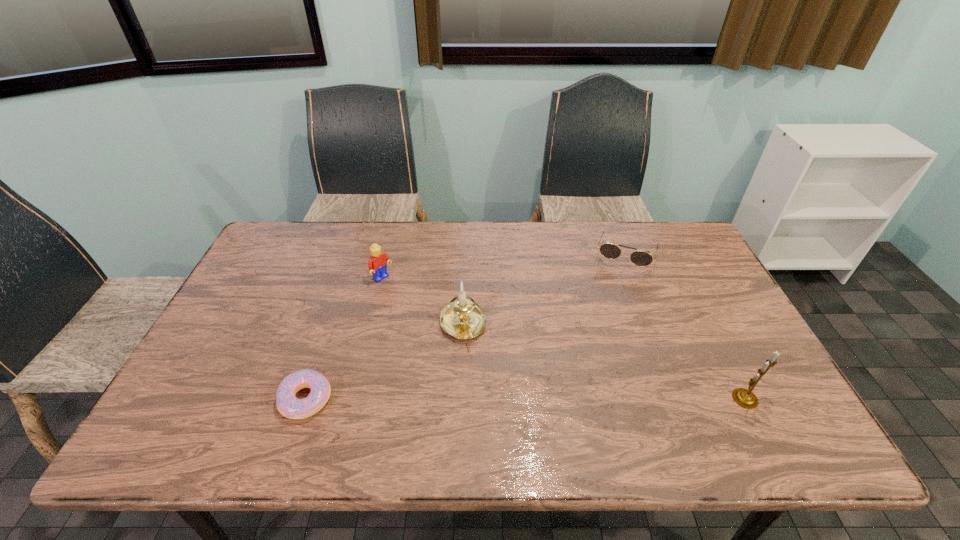
You are a GUI agent. You are given a task and a screenshot of the screen. Output one action in this format:
    pyautogui.click(x=<x>, y=<y>)
    Task: Click on the free region located 0.330m on the front lenses of the fourth tallest object
    The height and width of the screenshot is (540, 960).
    Given the screenshot: What is the action you would take?
    pyautogui.click(x=597, y=351)

The width and height of the screenshot is (960, 540). Find the location of `blank area located on the front lenses of the fourth tallest object`. blank area located on the front lenses of the fourth tallest object is located at coordinates (607, 317).

Where is `vacant space located on the front lenses of the fourth tallest object`? The height and width of the screenshot is (540, 960). vacant space located on the front lenses of the fourth tallest object is located at coordinates (591, 371).

Where is `vacant point located 0.120m on the front-facing side of the fourth object from right to left`? The width and height of the screenshot is (960, 540). vacant point located 0.120m on the front-facing side of the fourth object from right to left is located at coordinates (414, 302).

This screenshot has height=540, width=960. I want to click on free region located on the front-facing side of the fourth object from right to left, so click(440, 321).

Where is `free space located 0.190m on the front-facing side of the fourth object from right to left`? free space located 0.190m on the front-facing side of the fourth object from right to left is located at coordinates (430, 314).

The height and width of the screenshot is (540, 960). Find the location of `free space located on the handle side of the second tallest object`. free space located on the handle side of the second tallest object is located at coordinates [x=475, y=370].

Locate an element on the screen. The image size is (960, 540). blank space located on the handle side of the second tallest object is located at coordinates (490, 410).

You are a GUI agent. You are given a task and a screenshot of the screen. Output one action in this format:
    pyautogui.click(x=<x>, y=<y>)
    Task: Click on the object at the far edge
    This screenshot has width=960, height=540.
    Given the screenshot: What is the action you would take?
    pyautogui.click(x=610, y=251)

The width and height of the screenshot is (960, 540). Identify the location of doughnut that is positioned at the near edge. (290, 406).